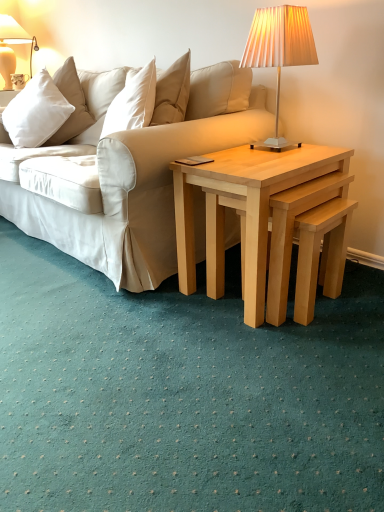
Question: Considering the relative positions of matte cream lampshade at upper right, positioned as the 1th lamp in right-to-left order, and matte white lampshade at upper left, arranged as the 1th lamp when viewed from the top, in the image provided, is matte cream lampshade at upper right, positioned as the 1th lamp in right-to-left order, behind matte white lampshade at upper left, arranged as the 1th lamp when viewed from the top,?

Choices:
 (A) no
 (B) yes

Answer: (A)

Question: Is matte cream lampshade at upper right, the 1th lamp viewed from the front, at the right side of matte white lampshade at upper left, which is counted as the second lamp, starting from the bottom?

Choices:
 (A) yes
 (B) no

Answer: (A)

Question: Does matte cream lampshade at upper right, marked as the 2th lamp in a left-to-right arrangement, have a greater height compared to matte white lampshade at upper left, the 1th lamp when ordered from back to front?

Choices:
 (A) yes
 (B) no

Answer: (B)

Question: Is matte cream lampshade at upper right, the 1th lamp viewed from the front, turned away from matte white lampshade at upper left, arranged as the 1th lamp when viewed from the top?

Choices:
 (A) no
 (B) yes

Answer: (A)

Question: Is matte cream lampshade at upper right, which ranks as the 1th lamp in bottom-to-top order, shorter than matte white lampshade at upper left, the 2th lamp viewed from the right?

Choices:
 (A) no
 (B) yes

Answer: (B)

Question: In terms of width, does white soft cushion at upper left look wider or thinner when compared to matte white lampshade at upper left, arranged as the 1th lamp when viewed from the top?

Choices:
 (A) thin
 (B) wide

Answer: (B)

Question: Is point (39, 83) closer or farther from the camera than point (6, 49)?

Choices:
 (A) closer
 (B) farther

Answer: (A)

Question: Based on their positions, is white soft cushion at upper left located to the left or right of matte white lampshade at upper left, arranged as the 1th lamp when viewed from the top?

Choices:
 (A) left
 (B) right

Answer: (B)

Question: From a real-world perspective, is white soft cushion at upper left positioned above or below matte white lampshade at upper left, which is counted as the second lamp, starting from the bottom?

Choices:
 (A) below
 (B) above

Answer: (A)

Question: In terms of height, does matte white lampshade at upper left, positioned as the second lamp in front-to-back order, look taller or shorter compared to matte cream lampshade at upper right, placed as the second lamp when sorted from back to front?

Choices:
 (A) tall
 (B) short

Answer: (A)

Question: Considering the relative positions of matte white lampshade at upper left, the 1th lamp when ordered from back to front, and matte cream lampshade at upper right, marked as the 2th lamp in a left-to-right arrangement, in the image provided, is matte white lampshade at upper left, the 1th lamp when ordered from back to front, to the left or to the right of matte cream lampshade at upper right, marked as the 2th lamp in a left-to-right arrangement,?

Choices:
 (A) left
 (B) right

Answer: (A)

Question: Is matte white lampshade at upper left, positioned as the second lamp in front-to-back order, wider or thinner than matte cream lampshade at upper right, which ranks as the 1th lamp in bottom-to-top order?

Choices:
 (A) thin
 (B) wide

Answer: (B)

Question: Is point (1, 36) closer or farther from the camera than point (271, 26)?

Choices:
 (A) closer
 (B) farther

Answer: (B)

Question: Considering the relative positions of matte cream lampshade at upper right, the second lamp viewed from the top, and light wood/natural wood nesting tables at center in the image provided, is matte cream lampshade at upper right, the second lamp viewed from the top, to the left or to the right of light wood/natural wood nesting tables at center?

Choices:
 (A) right
 (B) left

Answer: (A)

Question: From a real-world perspective, is matte cream lampshade at upper right, the 1th lamp viewed from the front, positioned above or below light wood/natural wood nesting tables at center?

Choices:
 (A) above
 (B) below

Answer: (A)